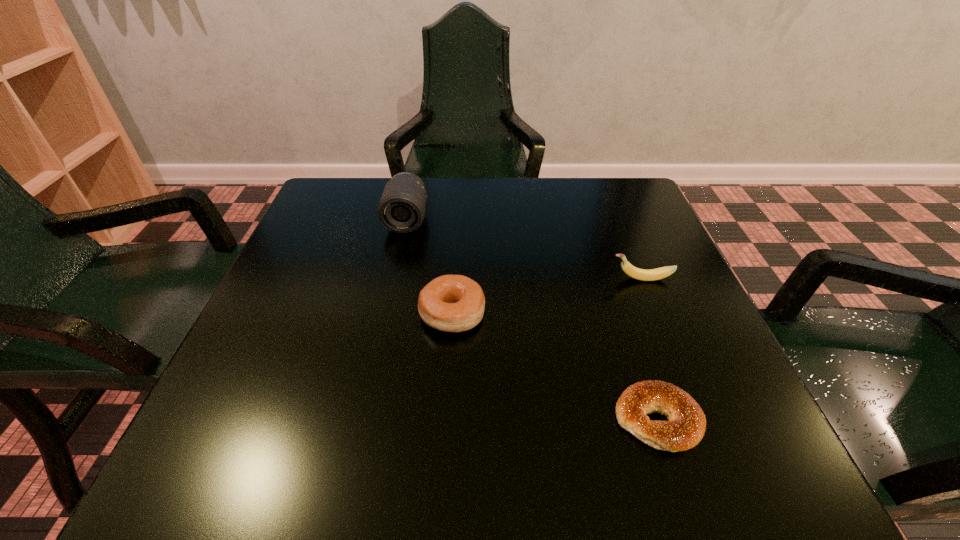
At what (x,y) coordinates should I click in order to perform the action: click on vacant space located 0.130m at the stem of the banana. Please return your answer as a coordinate pair (x, y). The height and width of the screenshot is (540, 960). Looking at the image, I should click on (545, 279).

At what (x,y) coordinates should I click in order to perform the action: click on vacant region located on the right of the taller bagel. Please return your answer as a coordinate pair (x, y). This screenshot has height=540, width=960. Looking at the image, I should click on (522, 314).

Find the location of a particular element. Image resolution: width=960 pixels, height=540 pixels. free spot located 0.380m on the left of the shorter bagel is located at coordinates (361, 419).

Locate an element on the screen. object that is at the far edge is located at coordinates (401, 209).

The image size is (960, 540). I want to click on object that is at the near edge, so click(686, 426).

Where is `banana present at the right edge`? The width and height of the screenshot is (960, 540). banana present at the right edge is located at coordinates (659, 273).

I want to click on bagel that is at the right edge, so click(x=686, y=426).

This screenshot has width=960, height=540. What are the coordinates of `object present at the near right corner` in the screenshot? It's located at (686, 426).

The height and width of the screenshot is (540, 960). I want to click on free space at the far edge of the desktop, so click(x=466, y=213).

Locate an element on the screen. vacant space at the near edge of the desktop is located at coordinates (323, 481).